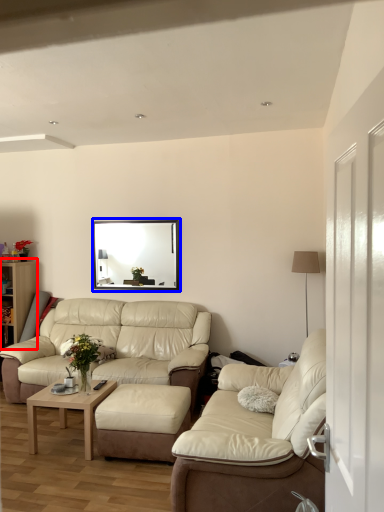
Question: Which of the following is the farthest to the observer, dresser (highlighted by a red box) or picture frame (highlighted by a blue box)?

Choices:
 (A) dresser
 (B) picture frame

Answer: (A)